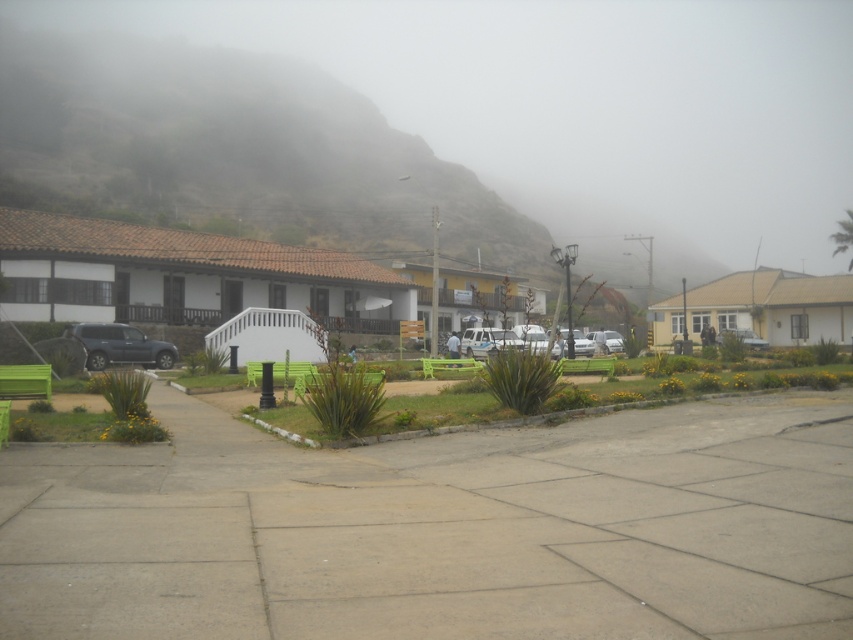
Looking at this image, you are standing at the center of the paved area in the foreground of the outdoor scene. You want to find the point at coordinates (235, 154). In which direction should you look to locate this point?

The point at coordinates (235, 154) is on the brown textured mountain at upper left, so you should look towards the upper left direction to locate it.

In the scene shown: You are standing in the plaza and want to take a photo of the brown textured mountain at upper left and the white matte building at left. Which object should you point your camera upwards to capture?

You should point your camera upwards to capture the brown textured mountain at upper left because it is positioned above the white matte building at left.